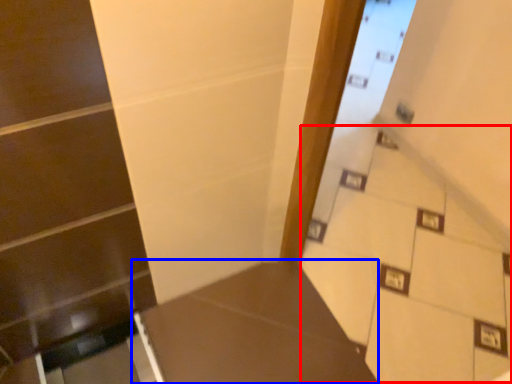
Question: Which object is further to the camera taking this photo, stairwell (highlighted by a red box) or table (highlighted by a blue box)?

Choices:
 (A) stairwell
 (B) table

Answer: (B)